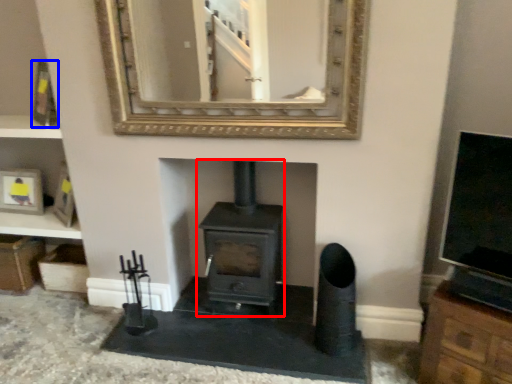
Question: Among these objects, which one is farthest to the camera, wood burning stove (highlighted by a red box) or picture frame (highlighted by a blue box)?

Choices:
 (A) wood burning stove
 (B) picture frame

Answer: (B)